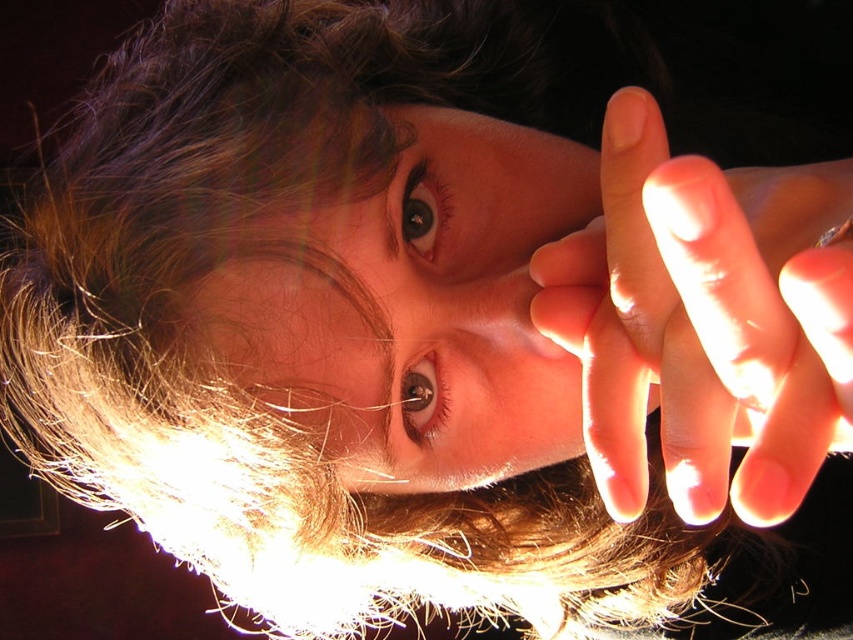
Question: Can you confirm if matte skin face at center is smaller than smooth skin hand at right?

Choices:
 (A) yes
 (B) no

Answer: (B)

Question: Which object appears closest to the camera in this image?

Choices:
 (A) matte skin face at center
 (B) smooth skin hand at right

Answer: (B)

Question: Can you confirm if matte skin face at center is smaller than smooth skin hand at right?

Choices:
 (A) no
 (B) yes

Answer: (A)

Question: Is the position of matte skin face at center more distant than that of smooth skin hand at right?

Choices:
 (A) yes
 (B) no

Answer: (A)